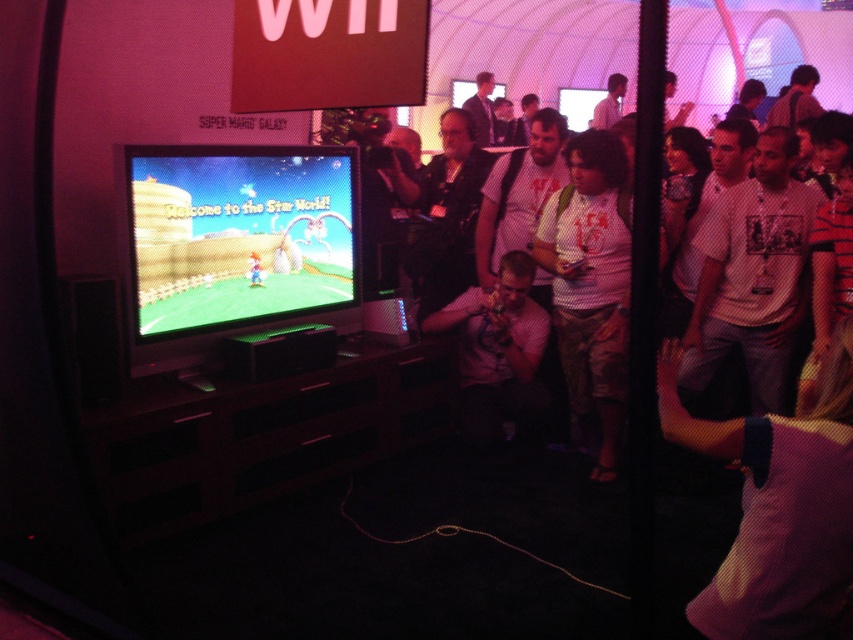
Does point (770, 385) come closer to viewer compared to point (589, 438)?

Yes, point (770, 385) is in front of point (589, 438).

Who is more forward, (718, 301) or (561, 196)?

Point (718, 301)

Who is more distant from viewer, (712, 236) or (602, 401)?

Result: Positioned behind is point (602, 401).

Identify the location of white printed t-shirt at center. (752, 275).

Which is in front, point (721, 432) or point (560, 296)?

Point (721, 432) is more forward.

Can you confirm if purple mesh shirt at center is positioned to the right of white t-shirt at center?

No, purple mesh shirt at center is not to the right of white t-shirt at center.

Does point (843, 387) lie in front of point (448, 314)?

Yes, point (843, 387) is in front of point (448, 314).

This screenshot has width=853, height=640. Find the location of `purple mesh shirt at center`. purple mesh shirt at center is located at coordinates (778, 508).

Is white t-shirt at center positioned at the back of white dotted shirt at center?

No, it is in front of white dotted shirt at center.

Who is shorter, white t-shirt at center or white dotted shirt at center?

white dotted shirt at center is shorter.

At what (x,y) coordinates should I click in order to perform the action: click on white t-shirt at center. Please return your answer as a coordinate pair (x, y). Looking at the image, I should click on (566, 256).